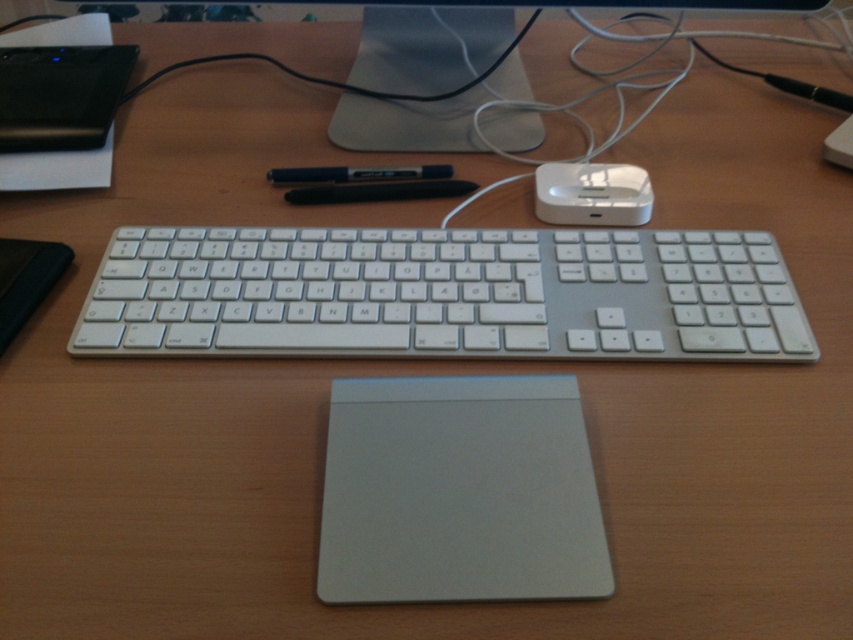
You are setting up your desk and want to place a new cup between the silver aluminum keyboard at center and the black rubber pen at center. Based on their positions, where should you place the cup to ensure it is between them?

The silver aluminum keyboard at center is closer to the viewer than the black rubber pen at center, so place the cup between them by positioning it closer to the keyboard but still in front of the pen.